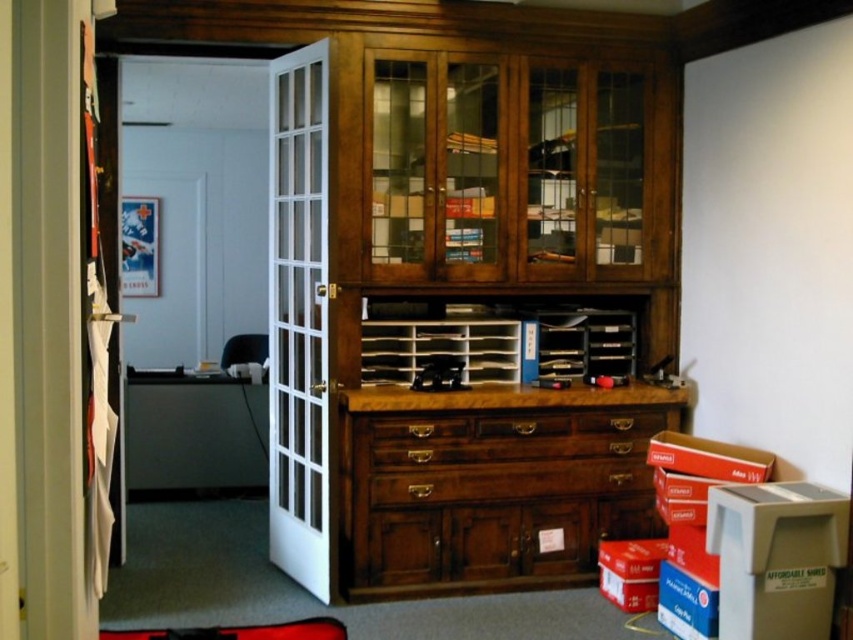
This screenshot has width=853, height=640. Identify the location of wooden drawer at center. (419, 428).

Between wooden drawer at center and brown wood drawer at center, which one appears on the left side from the viewer's perspective?

Positioned to the left is wooden drawer at center.

What do you see at coordinates (419, 428) in the screenshot? I see `wooden drawer at center` at bounding box center [419, 428].

The height and width of the screenshot is (640, 853). Find the location of `wooden drawer at center`. wooden drawer at center is located at coordinates [x=419, y=428].

Can you confirm if white glass door at left is positioned to the right of brown wood drawer at center?

Incorrect, white glass door at left is not on the right side of brown wood drawer at center.

Can you confirm if white glass door at left is positioned above brown wood drawer at center?

Yes, white glass door at left is above brown wood drawer at center.

Who is more distant from viewer, (270, 257) or (630, 428)?

Positioned behind is point (270, 257).

Find the location of a particular element. white glass door at left is located at coordinates (299, 317).

Can you confirm if white glass door at left is positioned below wooden drawer at center?

Actually, white glass door at left is above wooden drawer at center.

Does white glass door at left appear on the right side of wooden drawer at center?

In fact, white glass door at left is to the left of wooden drawer at center.

Who is more distant from viewer, (291, 554) or (415, 438)?

Positioned behind is point (291, 554).

Locate an element on the screen. Image resolution: width=853 pixels, height=640 pixels. white glass door at left is located at coordinates (299, 317).